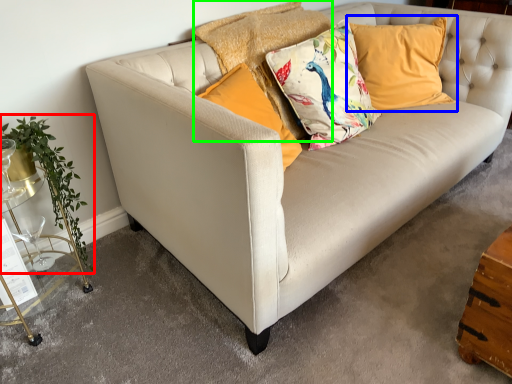
Question: Which object is positioned farthest from plant (highlighted by a red box)? Select from pillow (highlighted by a blue box) and pillow (highlighted by a green box).

Choices:
 (A) pillow
 (B) pillow

Answer: (A)